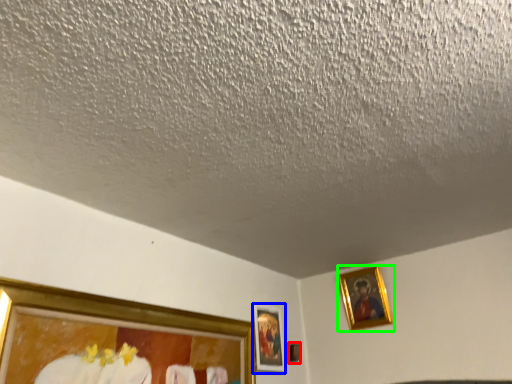
Question: Estimate the real-world distances between objects in this image. Which object is closer to picture frame (highlighted by a red box), picture frame (highlighted by a blue box) or picture frame (highlighted by a green box)?

Choices:
 (A) picture frame
 (B) picture frame

Answer: (A)